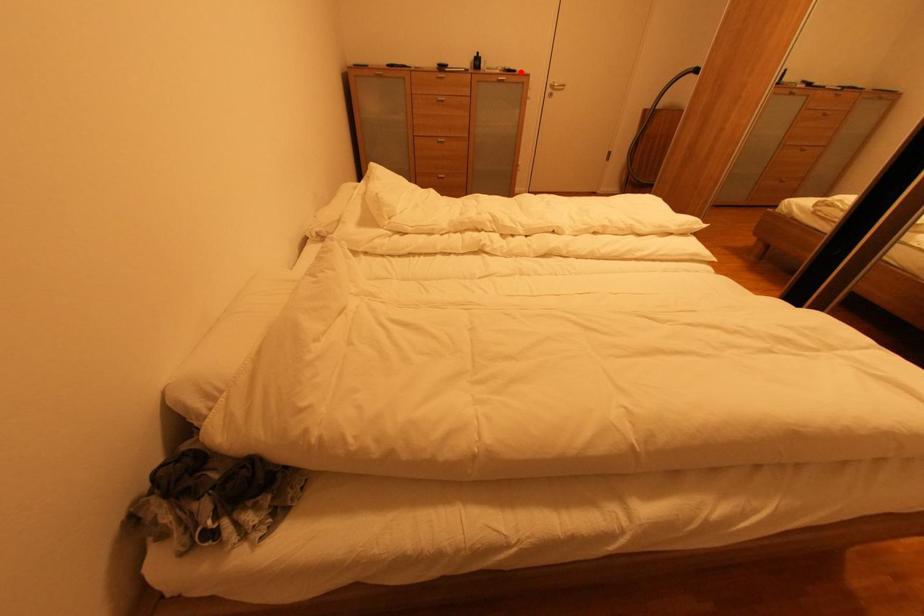
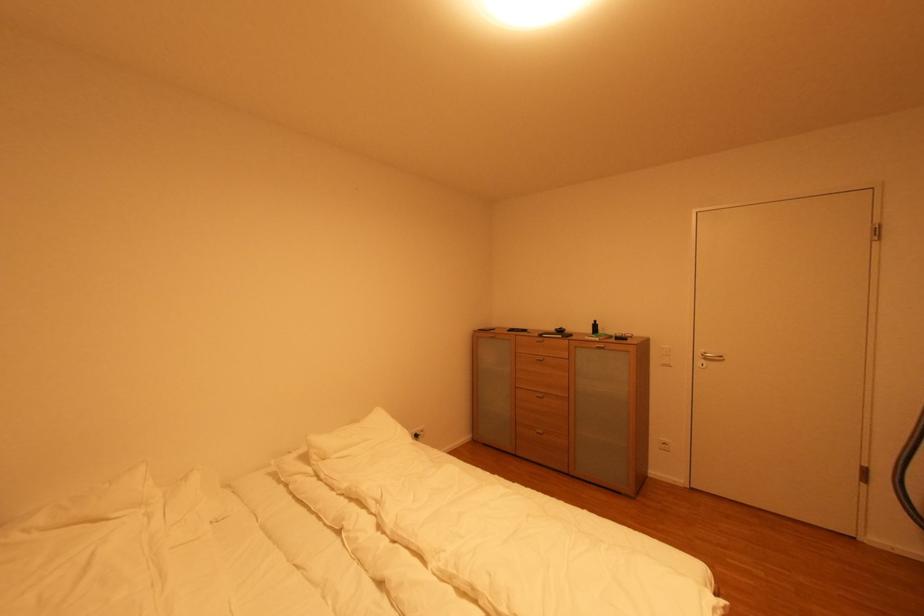
The point at the highlighted location is marked in the first image. Where is the corresponding point in the second image?

(630, 339)